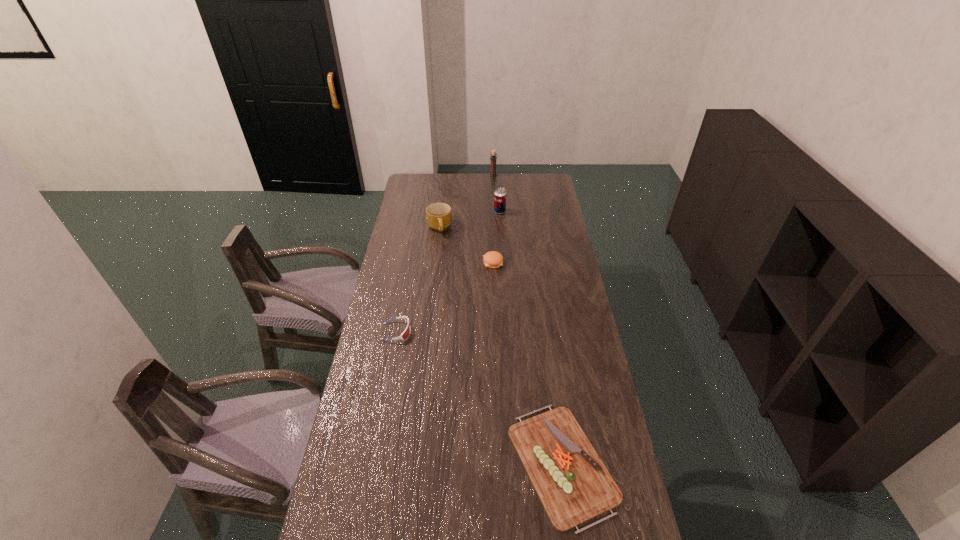
Locate an element on the screen. The width and height of the screenshot is (960, 540). free space between the third nearest object and the fifth shortest object is located at coordinates (496, 237).

In order to click on free space between the candle holder and the fourth shortest object in this screenshot , I will do `click(467, 201)`.

Where is `object that stands as the fourth closest to the patty`? This screenshot has width=960, height=540. object that stands as the fourth closest to the patty is located at coordinates (573, 484).

You are a GUI agent. You are given a task and a screenshot of the screen. Output one action in this format:
    pyautogui.click(x=<x>, y=<y>)
    Task: Click on the object that is the fourth nearest to the fifth nearest object
    
    Given the screenshot: What is the action you would take?
    pyautogui.click(x=405, y=334)

You are a GUI agent. You are given a task and a screenshot of the screen. Output one action in this format:
    pyautogui.click(x=<x>, y=<y>)
    Task: Click on the vacant region that satisfies the following two spatial constraints: 1. on the front side of the second farthest object; 2. on the front-facing side of the second nearest object
    
    Given the screenshot: What is the action you would take?
    pyautogui.click(x=507, y=332)

You are a GUI agent. You are given a task and a screenshot of the screen. Output one action in this format:
    pyautogui.click(x=<x>, y=<y>)
    Task: Click on the free region that satisfies the following two spatial constraints: 1. on the side with the handle of the nearest object; 2. on the left side of the third farthest object
    This screenshot has width=960, height=540.
    Given the screenshot: What is the action you would take?
    pyautogui.click(x=412, y=463)